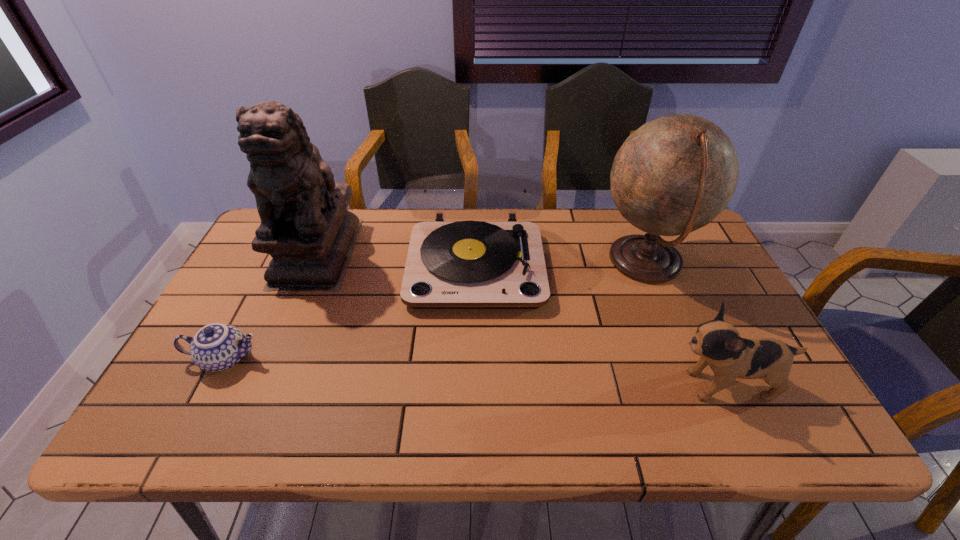
This screenshot has width=960, height=540. I want to click on free space between the chinaware and the puppy, so click(x=475, y=372).

Identify the location of free point between the puppy and the third tallest object. (600, 325).

What are the coordinates of `free space between the shortest object and the globe` in the screenshot? It's located at (436, 310).

I want to click on unoccupied position between the globe and the shortest object, so click(436, 310).

This screenshot has width=960, height=540. I want to click on empty space between the globe and the fourth tallest object, so click(685, 323).

Where is `free space between the record player and the sculpture`? free space between the record player and the sculpture is located at coordinates (396, 259).

The width and height of the screenshot is (960, 540). What are the coordinates of `unoccupied position between the sculpture and the chinaware` in the screenshot? It's located at (272, 306).

You are a GUI agent. You are given a task and a screenshot of the screen. Output one action in this format:
    pyautogui.click(x=<x>, y=<y>)
    Task: Click on the free space that is in between the puppy and the shortest object
    The height and width of the screenshot is (540, 960).
    Given the screenshot: What is the action you would take?
    pyautogui.click(x=475, y=372)

Choose which object is the second nearest neighbor to the third shortest object. Please provide its 2D coordinates. Your answer should be formatted as a tuple, i.e. [(x, y)], where the tuple contains the x and y coordinates of a point satisfying the conditions above.

[(305, 227)]

Locate an element on the screen. This screenshot has width=960, height=540. object that is the third closest to the chinaware is located at coordinates (675, 174).